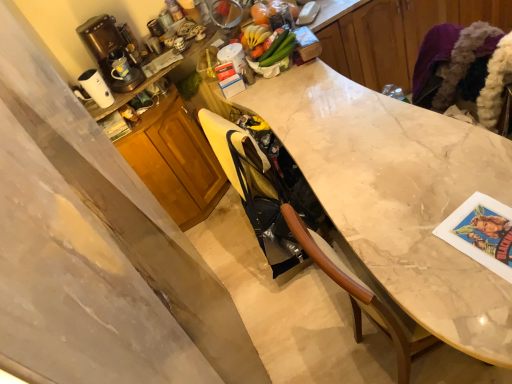
The image size is (512, 384). Describe the element at coordinates (110, 50) in the screenshot. I see `brown plastic coffee machine at upper left` at that location.

The image size is (512, 384). What are the coordinates of `marble at center` in the screenshot? It's located at (397, 195).

Find the location of a particular element. This screenshot has height=384, width=512. black leather swivel chair at center is located at coordinates (256, 192).

Who is more distant, brown plastic coffee machine at upper left or black leather swivel chair at center?

brown plastic coffee machine at upper left.

Which of these two, brown plastic coffee machine at upper left or black leather swivel chair at center, is smaller?

Smaller between the two is black leather swivel chair at center.

Would you consider brown plastic coffee machine at upper left to be distant from black leather swivel chair at center?

brown plastic coffee machine at upper left is near black leather swivel chair at center, not far away.

Is brown plastic coffee machine at upper left positioned with its back to black leather swivel chair at center?

No, brown plastic coffee machine at upper left's orientation is not away from black leather swivel chair at center.

From a real-world perspective, which is physically below, wooden cabinet at center, positioned as the first cabinetry in left-to-right order, or black leather swivel chair at center?

wooden cabinet at center, positioned as the first cabinetry in left-to-right order.

Does wooden cabinet at center, positioned as the first cabinetry in left-to-right order, turn towards black leather swivel chair at center?

Yes, wooden cabinet at center, positioned as the first cabinetry in left-to-right order, faces towards black leather swivel chair at center.

Measure the distance between wooden cabinet at center, positioned as the first cabinetry in left-to-right order, and black leather swivel chair at center.

wooden cabinet at center, positioned as the first cabinetry in left-to-right order, and black leather swivel chair at center are 26.80 inches apart.

Is black leather swivel chair at center taller than marble at center?

Incorrect, the height of black leather swivel chair at center is not larger of that of marble at center.

Is black leather swivel chair at center aimed at marble at center?

No, black leather swivel chair at center is not turned towards marble at center.

Identify the location of countertop that appears above the black leather swivel chair at center (from the image's perspective). (397, 195).

Is black leather swivel chair at center positioned far away from marble at center?

No, black leather swivel chair at center is in close proximity to marble at center.

The width and height of the screenshot is (512, 384). What are the coordinates of `countertop in front of the white marble countertop at center, which appears as the 1th cabinetry when viewed from the right` in the screenshot? It's located at (397, 195).

Is white marble countertop at center, placed as the second cabinetry when sorted from left to right, closer to camera compared to marble at center?

No, white marble countertop at center, placed as the second cabinetry when sorted from left to right, is further to the viewer.

Is white marble countertop at center, which appears as the 1th cabinetry when viewed from the right, facing away from marble at center?

No, white marble countertop at center, which appears as the 1th cabinetry when viewed from the right, is not facing away from marble at center.

From the image's perspective, is white glossy electric kettle at upper left positioned above or below wooden cabinet at center, which is the second cabinetry in right-to-left order?

white glossy electric kettle at upper left is situated higher than wooden cabinet at center, which is the second cabinetry in right-to-left order, in the image.

In the scene shown: In the image, is white glossy electric kettle at upper left positioned in front of or behind wooden cabinet at center, which is the second cabinetry in right-to-left order?

white glossy electric kettle at upper left is in front of wooden cabinet at center, which is the second cabinetry in right-to-left order.

From a real-world perspective, which cabinetry is the 2nd one underneath the white glossy electric kettle at upper left? Please provide its 2D coordinates.

[(175, 161)]

From a real-world perspective, is marble at center on white marble countertop at center, the first cabinetry viewed from the top?

No, from a real-world perspective, marble at center is not over white marble countertop at center, the first cabinetry viewed from the top

Does marble at center have a greater width compared to white marble countertop at center, the first cabinetry viewed from the top?

Result: No.

Is white marble countertop at center, the first cabinetry viewed from the top, located within marble at center?

No.

Does white marble countertop at center, the first cabinetry viewed from the top, appear on the left side of white glossy electric kettle at upper left?

No, white marble countertop at center, the first cabinetry viewed from the top, is not to the left of white glossy electric kettle at upper left.

At what (x,y) coordinates should I click in order to perform the action: click on appliance that is below the white marble countertop at center, which appears as the 1th cabinetry when viewed from the right (from the image's perspective). Please return your answer as a coordinate pair (x, y). Looking at the image, I should click on (96, 88).

Based on the photo, would you say white marble countertop at center, the second cabinetry positioned from the bottom, is inside or outside white glossy electric kettle at upper left?

white marble countertop at center, the second cabinetry positioned from the bottom, exists outside the volume of white glossy electric kettle at upper left.

From a real-world perspective, between white marble countertop at center, the second cabinetry positioned from the bottom, and white glossy electric kettle at upper left, who is vertically lower?

white marble countertop at center, the second cabinetry positioned from the bottom, from a real-world perspective.

The width and height of the screenshot is (512, 384). I want to click on swivel chair below the brown plastic coffee machine at upper left (from the image's perspective), so click(x=256, y=192).

Locate an element on the screen. the 2nd cabinetry directly beneath the black leather swivel chair at center (from a real-world perspective) is located at coordinates (175, 161).

Which object lies further to the anchor point white glossy electric kettle at upper left, brown plastic coffee machine at upper left or wooden cabinet at center, which is the 1th cabinetry from bottom to top?

Based on the image, wooden cabinet at center, which is the 1th cabinetry from bottom to top, appears to be further to white glossy electric kettle at upper left.

Which object lies further to the anchor point black leather swivel chair at center, wooden cabinet at center, marked as the second cabinetry in a top-to-bottom arrangement, or white marble countertop at center, the first cabinetry viewed from the top?

white marble countertop at center, the first cabinetry viewed from the top, is positioned further to the anchor black leather swivel chair at center.

Based on their spatial positions, is wooden cabinet at center, positioned as the first cabinetry in left-to-right order, or marble at center further from white glossy electric kettle at upper left?

Based on the image, marble at center appears to be further to white glossy electric kettle at upper left.

From the image, which object appears to be farther from wooden cabinet at center, marked as the second cabinetry in a top-to-bottom arrangement, black leather swivel chair at center or white marble countertop at center, placed as the second cabinetry when sorted from left to right?

white marble countertop at center, placed as the second cabinetry when sorted from left to right.

In the scene shown: Considering their positions, is brown plastic coffee machine at upper left positioned further to marble at center than black leather swivel chair at center?

brown plastic coffee machine at upper left is further to marble at center.

From the image, which object appears to be farther from black leather swivel chair at center, white marble countertop at center, the first cabinetry viewed from the top, or brown plastic coffee machine at upper left?

white marble countertop at center, the first cabinetry viewed from the top, is further to black leather swivel chair at center.

Considering their positions, is white glossy electric kettle at upper left positioned further to black leather swivel chair at center than brown plastic coffee machine at upper left?

Based on the image, white glossy electric kettle at upper left appears to be further to black leather swivel chair at center.

Considering their positions, is white glossy electric kettle at upper left positioned further to wooden cabinet at center, positioned as the first cabinetry in left-to-right order, than white marble countertop at center, which appears as the 1th cabinetry when viewed from the right?

white marble countertop at center, which appears as the 1th cabinetry when viewed from the right, is positioned further to the anchor wooden cabinet at center, positioned as the first cabinetry in left-to-right order.

Locate an element on the screen. swivel chair located between wooden cabinet at center, which is the second cabinetry in right-to-left order, and white marble countertop at center, the second cabinetry positioned from the bottom, in the left-right direction is located at coordinates (256, 192).

The image size is (512, 384). Find the location of `coffee machine between white glossy electric kettle at upper left and marble at center in the horizontal direction`. coffee machine between white glossy electric kettle at upper left and marble at center in the horizontal direction is located at coordinates (110, 50).

This screenshot has width=512, height=384. In order to click on appliance between brown plastic coffee machine at upper left and wooden cabinet at center, marked as the second cabinetry in a top-to-bottom arrangement, in the up-down direction in this screenshot , I will do (96, 88).

Locate an element on the screen. coffee machine between marble at center and wooden cabinet at center, which is the second cabinetry in right-to-left order, along the z-axis is located at coordinates (110, 50).